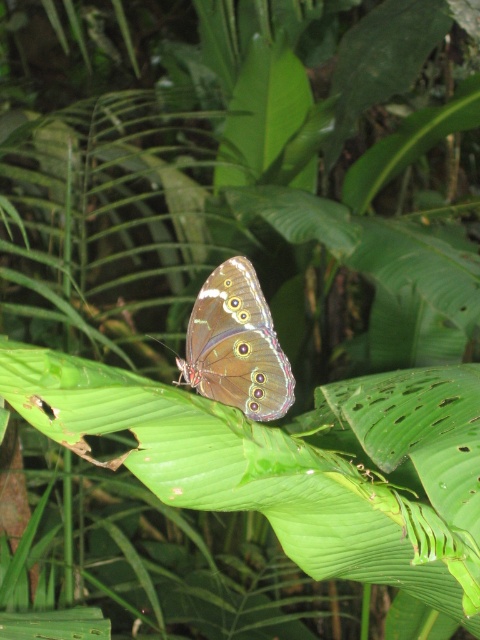
Does green matte leaf at center have a greater width compared to brown iridescent butterfly at center?

Correct, the width of green matte leaf at center exceeds that of brown iridescent butterfly at center.

This screenshot has height=640, width=480. What are the coordinates of `green matte leaf at center` in the screenshot? It's located at (282, 468).

Does point (303, 531) come farther from viewer compared to point (224, 388)?

Yes.

Locate an element on the screen. Image resolution: width=480 pixels, height=640 pixels. green matte leaf at center is located at coordinates (282, 468).